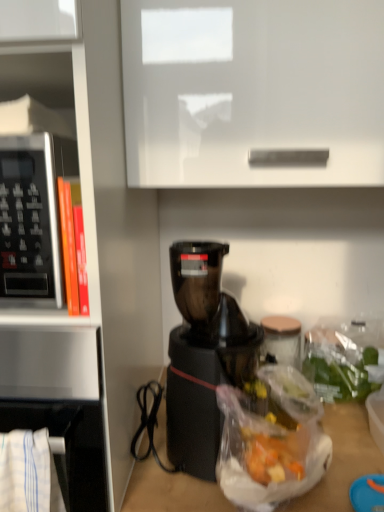
Question: Is white glossy cabinet at upper center shorter than translucent plastic bag at lower right?

Choices:
 (A) no
 (B) yes

Answer: (A)

Question: Can you confirm if white glossy cabinet at upper center is taller than translucent plastic bag at lower right?

Choices:
 (A) yes
 (B) no

Answer: (A)

Question: Does white glossy cabinet at upper center contain translucent plastic bag at lower right?

Choices:
 (A) yes
 (B) no

Answer: (B)

Question: Can you see white glossy cabinet at upper center touching translucent plastic bag at lower right?

Choices:
 (A) yes
 (B) no

Answer: (B)

Question: Can you confirm if white glossy cabinet at upper center is bigger than translucent plastic bag at lower right?

Choices:
 (A) no
 (B) yes

Answer: (B)

Question: Is white glossy cabinet at upper center positioned beyond the bounds of translucent plastic bag at lower right?

Choices:
 (A) no
 (B) yes

Answer: (B)

Question: Is black plastic microwave at left taller than translucent plastic bag at lower right?

Choices:
 (A) no
 (B) yes

Answer: (B)

Question: From the image's perspective, is black plastic microwave at left over translucent plastic bag at lower right?

Choices:
 (A) yes
 (B) no

Answer: (A)

Question: Can you confirm if black plastic microwave at left is positioned to the left of translucent plastic bag at lower right?

Choices:
 (A) no
 (B) yes

Answer: (B)

Question: From the image's perspective, is black plastic microwave at left under translucent plastic bag at lower right?

Choices:
 (A) no
 (B) yes

Answer: (A)

Question: Can you confirm if black plastic microwave at left is thinner than translucent plastic bag at lower right?

Choices:
 (A) no
 (B) yes

Answer: (A)

Question: Is black plastic microwave at left oriented away from translucent plastic bag at lower right?

Choices:
 (A) yes
 (B) no

Answer: (B)

Question: Is black plastic coffee maker at center next to satin silver microwave at left and touching it?

Choices:
 (A) yes
 (B) no

Answer: (B)